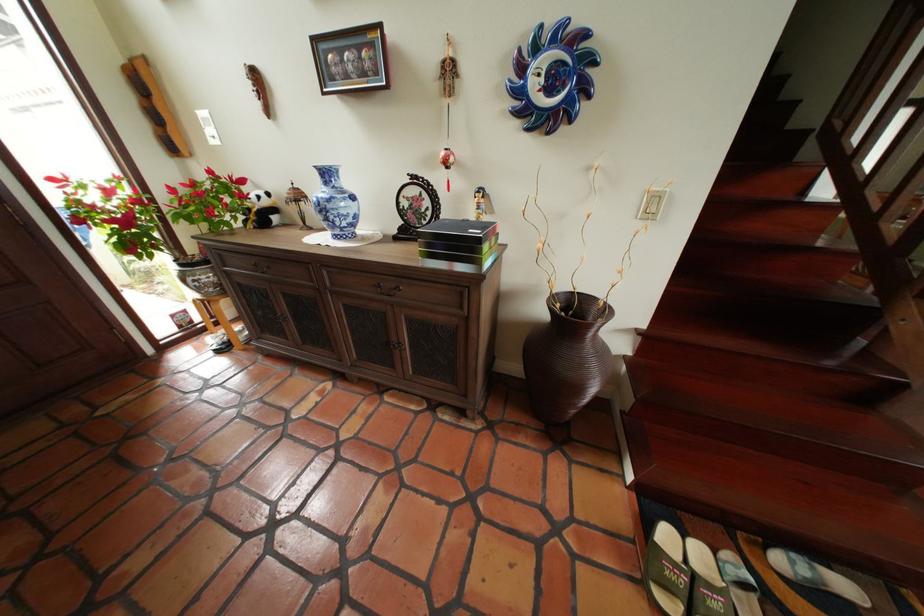
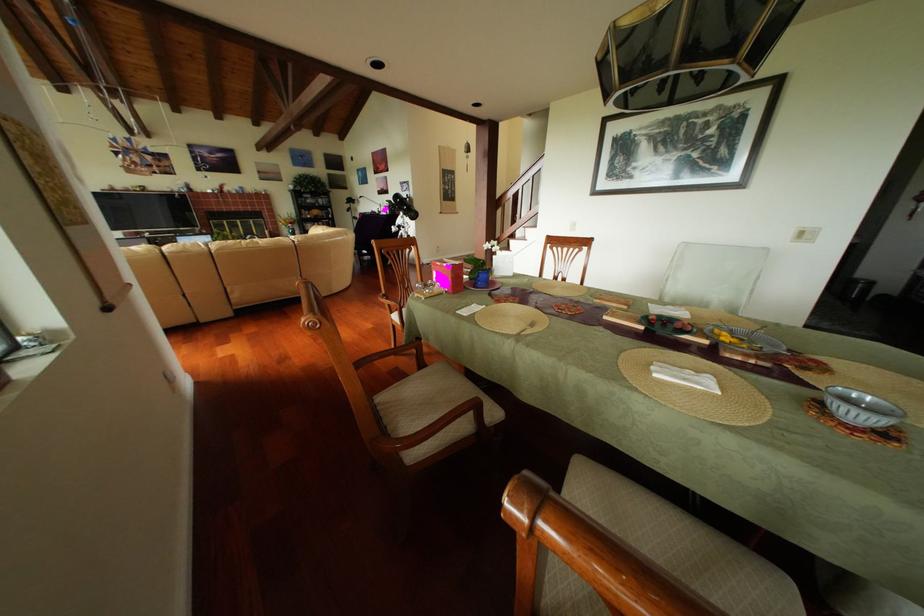
Question: I am providing you with two images of the same scene from different viewpoints. Please identify which objects are invisible in image2.

Choices:
 (A) patterned plant pot
 (B) blue flower pot
 (C) pink gift box
 (D) Koenic cardboard box

Answer: (A)